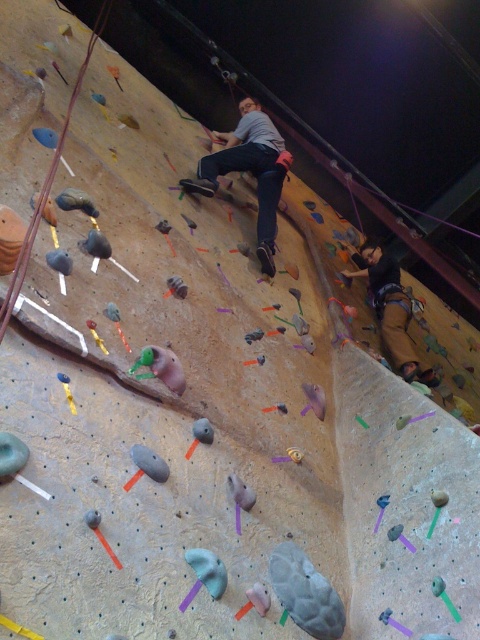
Can you confirm if gray matte shirt at center is bigger than brown leather pants at lower right?

Yes.

I want to click on gray matte shirt at center, so click(250, 170).

I want to click on gray matte shirt at center, so click(250, 170).

Find the location of a particular element. gray matte shirt at center is located at coordinates (250, 170).